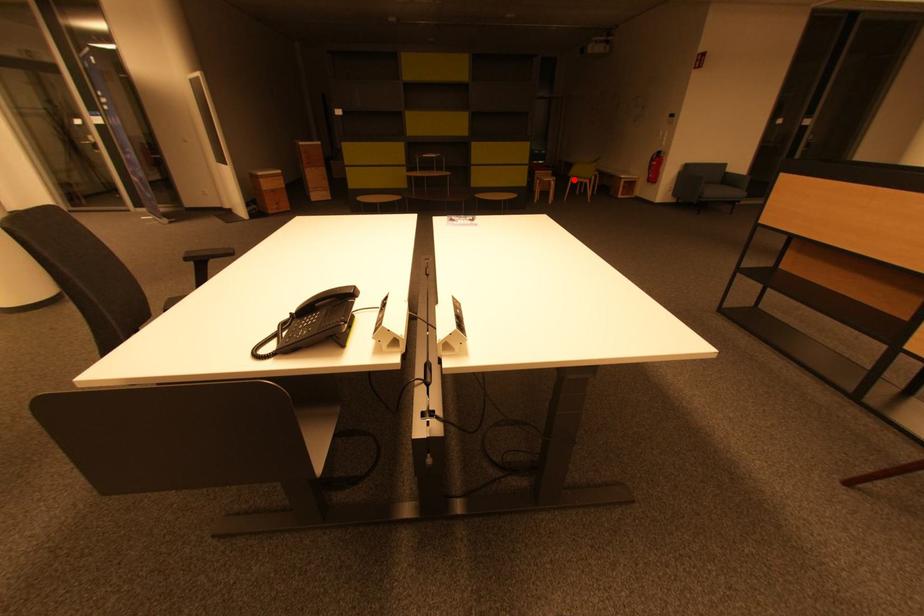
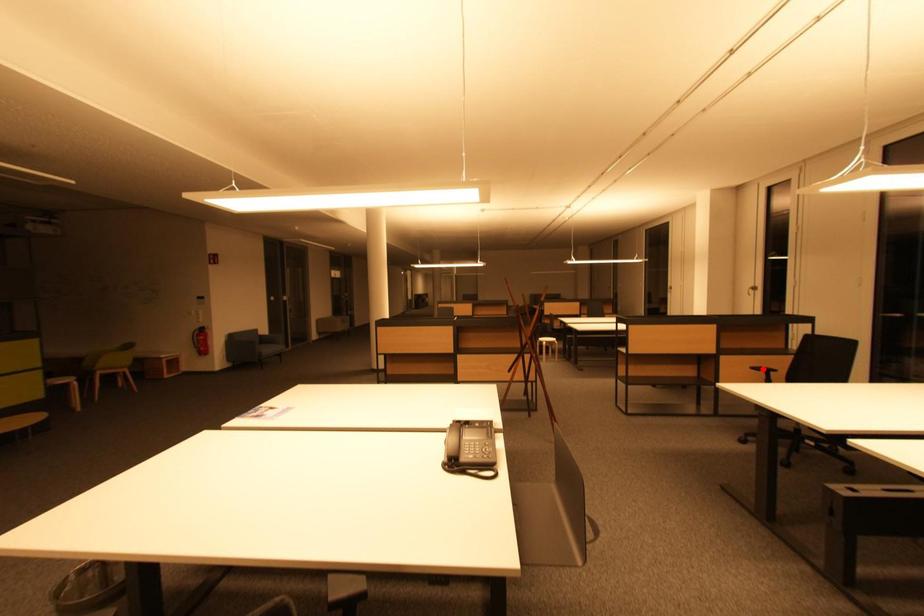
I am providing you with two images of the same scene from different viewpoints. A red point is marked on the first image and another point is marked on the second image. Is the marked point in image1 the same physical position as the marked point in image2?

No